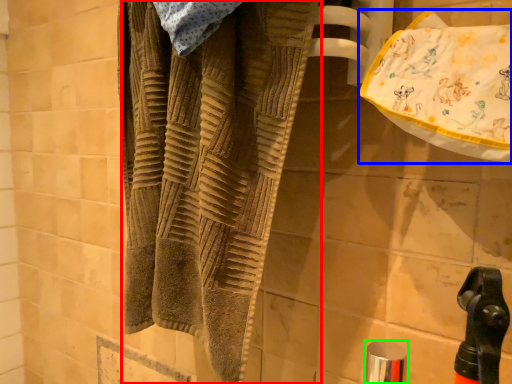
Question: Based on their relative distances, which object is farther from towel (highlighted by a red box)? Choose from beach towel (highlighted by a blue box) and faucet (highlighted by a green box).

Choices:
 (A) beach towel
 (B) faucet

Answer: (B)